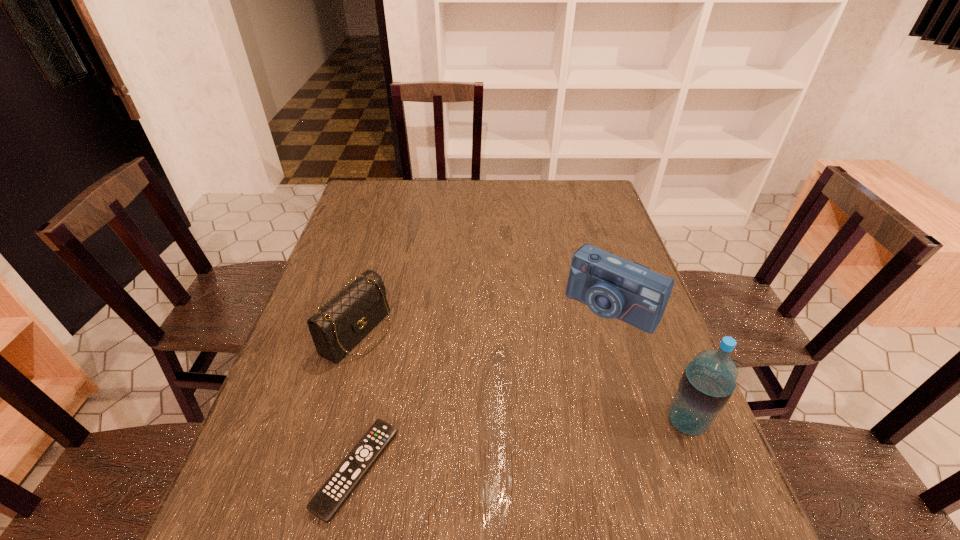
The image size is (960, 540). I want to click on vacant space located on the lens of the camera, so click(x=517, y=417).

At what (x,y) coordinates should I click in order to perform the action: click on vacant area situated on the lens of the camera. Please return your answer as a coordinate pair (x, y). The width and height of the screenshot is (960, 540). Looking at the image, I should click on (574, 348).

Find the location of a particular element. The width and height of the screenshot is (960, 540). object situated at the near edge is located at coordinates (327, 501).

In order to click on remote control positioned at the left edge in this screenshot , I will do `click(327, 501)`.

The image size is (960, 540). I want to click on clutch bag present at the left edge, so click(x=341, y=323).

The image size is (960, 540). I want to click on water bottle at the right edge, so click(708, 381).

Find the location of a particular element. camera that is positioned at the right edge is located at coordinates (612, 287).

At what (x,y) coordinates should I click in order to perform the action: click on object that is at the near left corner. Please return your answer as a coordinate pair (x, y). The image size is (960, 540). Looking at the image, I should click on (327, 501).

Find the location of a particular element. vacant space at the far edge is located at coordinates (499, 211).

In the image, there is a desktop. Where is `free region at the left edge`? free region at the left edge is located at coordinates (356, 234).